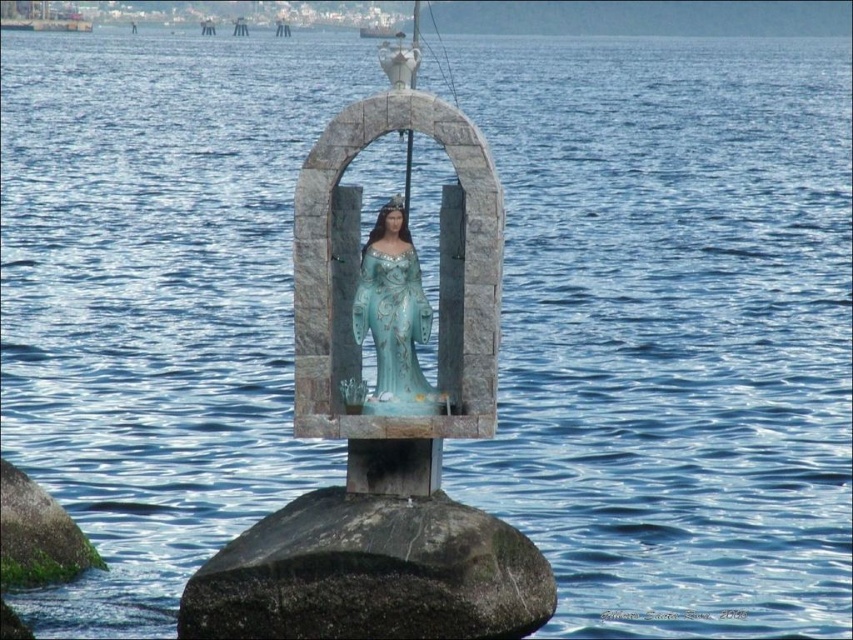
You are a tourist standing in front of the coastal statue scene. You notice the dark gray stone at center and the turquoise glossy statue at center. Which object is closer to you as you face the scene?

The dark gray stone at center is closer to you because it is positioned in front of the turquoise glossy statue at center.

You are a maintenance worker needing to clean the blue glossy statue at center. You have a 2.5 meter long pole. Can you reach the statue from the dark gray stone at center without moving the pole?

The distance between the blue glossy statue at center and the dark gray stone at center is 2.21 meters. Since the pole is 2.5 meters long, which is longer than the distance between them, you can reach the statue from the dark gray stone at center using the pole.